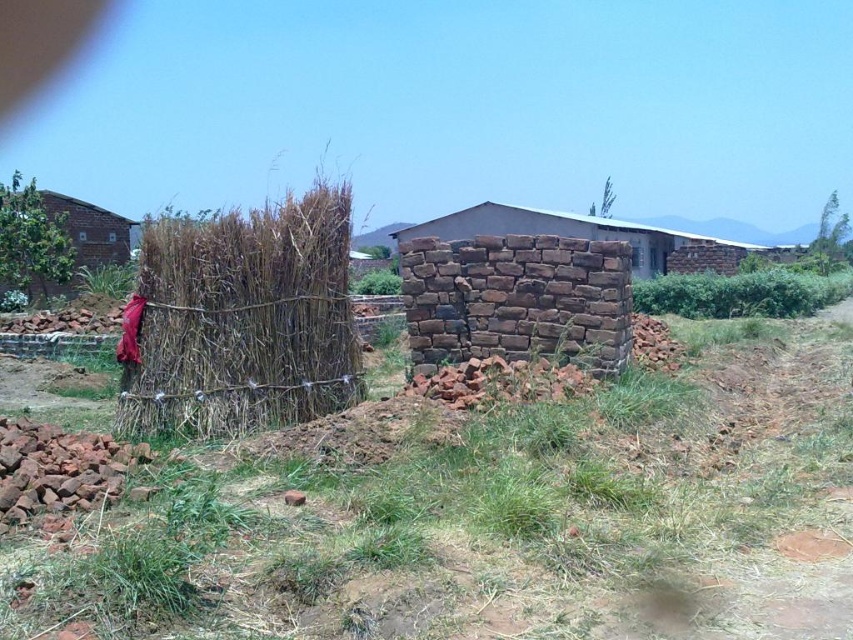
You are a construction worker who needs to build a sturdy fence. You have two options for materials in the scene. Which object is bigger and better suited for the task? Please choose between the brown stone wall at center and the brick wall at left.

The brown stone wall at center has a larger size compared to the brick wall at left, so it is better suited for building a sturdy fence.

In the scene shown: You are a construction worker who needs to build a fence. You have two options for walls in the scene. Which wall has a smaller width between the brown rough stone wall at center and the brown stone wall at center?

The brown rough stone wall at center has a lesser width compared to the brown stone wall at center, so the brown rough stone wall at center is the smaller one.

You are standing at the center of the rural scene and need to reach both the dry straw at left and the brick wall at left. Which object is farther away from your current position?

The dry straw at left is 19.46 meters away from the brick wall at left, so the dry straw at left is farther away from your current position.